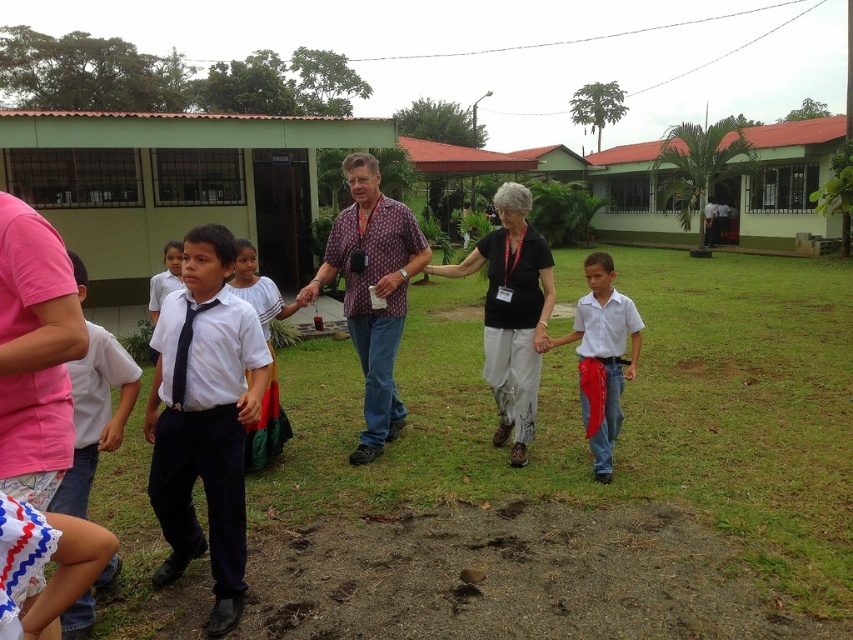
Between white cotton shirt at center and white glossy uniform at center, which one has less height?

white cotton shirt at center

Image resolution: width=853 pixels, height=640 pixels. In order to click on white cotton shirt at center in this screenshot , I will do `click(451, 509)`.

Between point (538, 432) and point (271, 300), which one is positioned in front?

Positioned in front is point (271, 300).

The image size is (853, 640). Identify the location of white cotton shirt at center. (451, 509).

Does point (334, 221) come farther from viewer compared to point (86, 451)?

Yes.

Does patterned fabric shirt at center appear over white cotton shirt at left?

Yes.

The image size is (853, 640). Identify the location of patterned fabric shirt at center. (372, 291).

Is patterned fabric shirt at center smaller than white uniform shirt at center?

No.

Can you confirm if patterned fabric shirt at center is wider than white uniform shirt at center?

Yes, patterned fabric shirt at center is wider than white uniform shirt at center.

Is point (373, 340) closer to viewer compared to point (157, 291)?

Yes.

Locate an element on the screen. The image size is (853, 640). patterned fabric shirt at center is located at coordinates click(x=372, y=291).